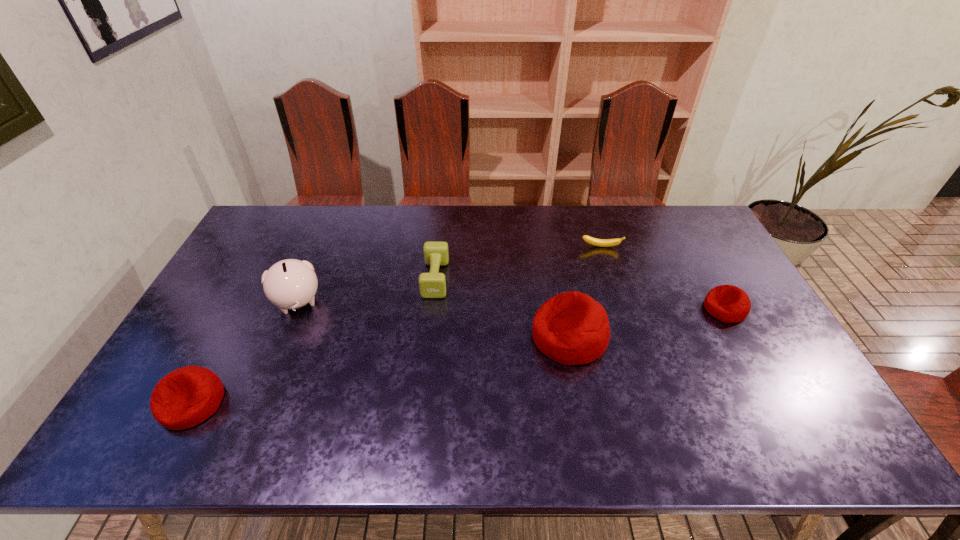
Locate an element on the screen. vacant spot for a new beanbag to ensure equal spacing is located at coordinates (394, 367).